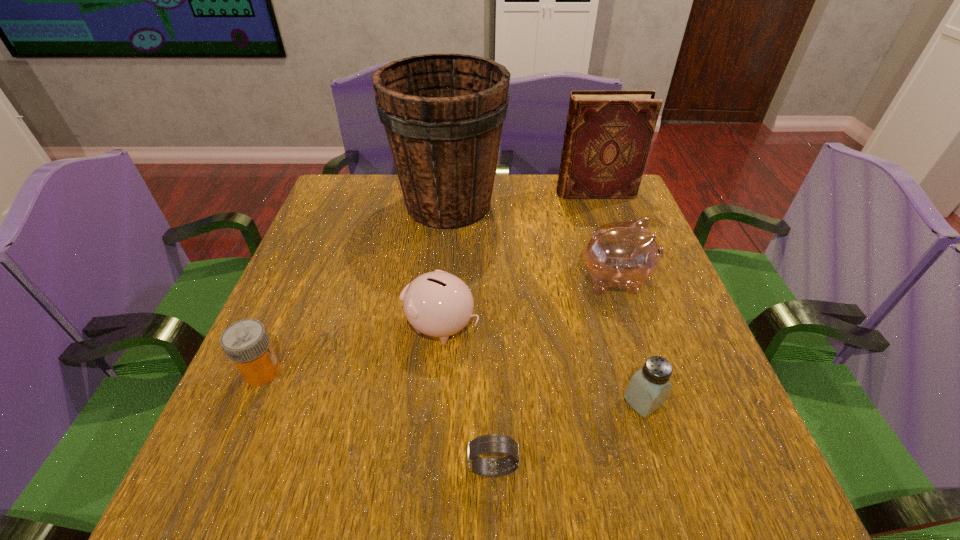
You are a GUI agent. You are given a task and a screenshot of the screen. Output one action in this format:
    pyautogui.click(x=<x>, y=<y>)
    Task: Click on the free location located on the right of the tallest object
    
    Given the screenshot: What is the action you would take?
    pyautogui.click(x=558, y=204)

In order to click on vacant space located on the spine side of the second tallest object in this screenshot , I will do `click(502, 193)`.

This screenshot has width=960, height=540. I want to click on free space located 0.160m on the spine side of the second tallest object, so click(x=502, y=193).

The image size is (960, 540). In order to click on vacant space located on the spine side of the second tallest object in this screenshot , I will do `click(495, 193)`.

Where is `vacant space situated 0.240m on the left of the shorter piggy bank`? The width and height of the screenshot is (960, 540). vacant space situated 0.240m on the left of the shorter piggy bank is located at coordinates tap(288, 326).

Where is `vacant region located 0.340m on the label side of the leftmost object`? This screenshot has height=540, width=960. vacant region located 0.340m on the label side of the leftmost object is located at coordinates (460, 372).

The width and height of the screenshot is (960, 540). I want to click on free space located 0.150m on the front of the saltshaker, so click(677, 511).

Where is `vacant space located on the face of the shortest object`? vacant space located on the face of the shortest object is located at coordinates [x=417, y=468].

You are a GUI agent. You are given a task and a screenshot of the screen. Output one action in this format:
    pyautogui.click(x=<x>, y=<y>)
    Task: Click on the free region located 0.060m on the face of the shortest object
    
    Given the screenshot: What is the action you would take?
    pyautogui.click(x=429, y=468)

Find the location of `vacant region located 0.060m on the face of the shortest object`. vacant region located 0.060m on the face of the shortest object is located at coordinates (429, 468).